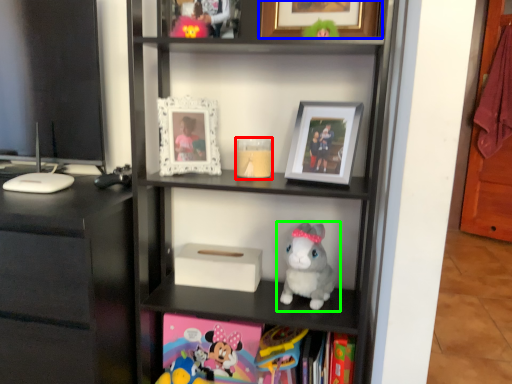
Question: Estimate the real-world distances between objects in this image. Which object is closer to candle holder (highlighted by a red box), picture frame (highlighted by a blue box) or toy (highlighted by a green box)?

Choices:
 (A) picture frame
 (B) toy

Answer: (B)